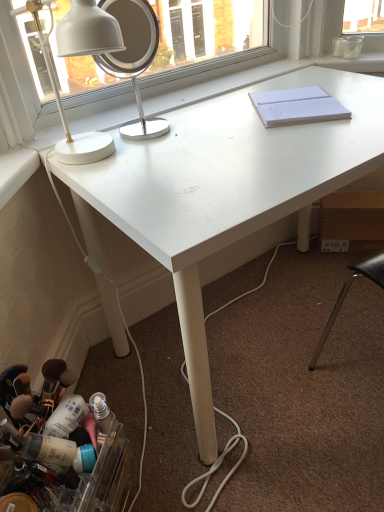
You are a GUI agent. You are given a task and a screenshot of the screen. Output one action in this format:
    pyautogui.click(x=<x>, y=<y>)
    Task: Click on the free location in front of white glossy desk lamp at upper left
    Image resolution: width=384 pixels, height=512 pixels.
    Given the screenshot: What is the action you would take?
    pyautogui.click(x=119, y=187)